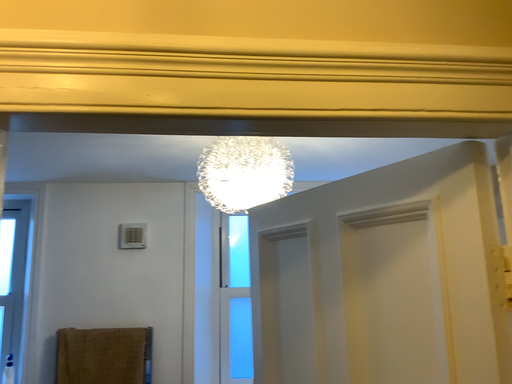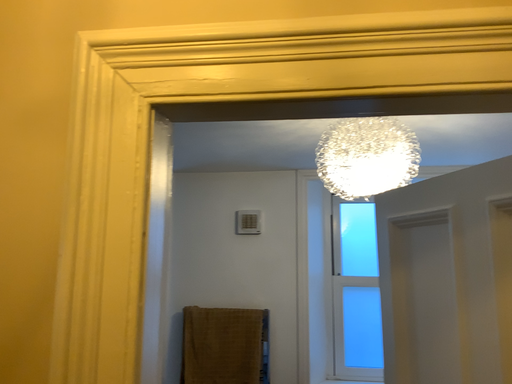
Question: How did the camera likely rotate when shooting the video?

Choices:
 (A) rotated right
 (B) rotated left

Answer: (B)